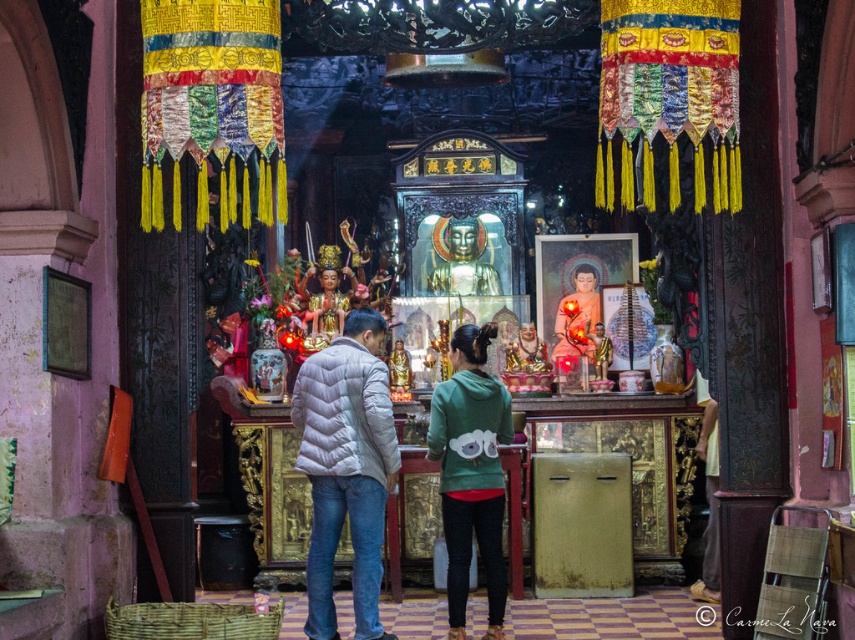
Does white quilted jacket at center have a greater height compared to matte green hoodie at center?

Yes, white quilted jacket at center is taller than matte green hoodie at center.

Between white quilted jacket at center and matte green hoodie at center, which one appears on the right side from the viewer's perspective?

Positioned to the right is matte green hoodie at center.

Locate an element on the screen. The image size is (855, 640). white quilted jacket at center is located at coordinates (346, 467).

Between green fleece jacket at center and matte green hoodie at center, which one has more height?

green fleece jacket at center is taller.

Based on the photo, who is more forward, (450,340) or (573,324)?

Point (450,340) is more forward.

At what (x,y) coordinates should I click in order to perform the action: click on green fleece jacket at center. Please return your answer as a coordinate pair (x, y). Looking at the image, I should click on pyautogui.click(x=470, y=472).

From the picture: Between white quilted jacket at center and green fleece jacket at center, which one is positioned higher?

green fleece jacket at center is above.

Can you confirm if white quilted jacket at center is smaller than green fleece jacket at center?

Indeed, white quilted jacket at center has a smaller size compared to green fleece jacket at center.

Which is in front, point (333, 509) or point (452, 353)?

Point (333, 509)

This screenshot has height=640, width=855. Find the location of `white quilted jacket at center`. white quilted jacket at center is located at coordinates (346, 467).